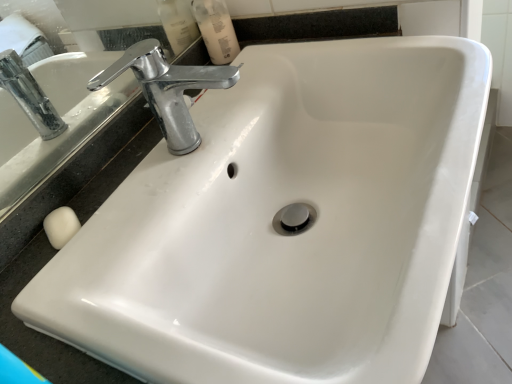
Find the location of a particular element. The image size is (512, 384). translucent plastic mouthwash at upper center is located at coordinates (216, 30).

This screenshot has width=512, height=384. What do you see at coordinates (216, 30) in the screenshot?
I see `translucent plastic mouthwash at upper center` at bounding box center [216, 30].

The image size is (512, 384). Identify the location of chrome metallic faucet at upper left. (168, 89).

Image resolution: width=512 pixels, height=384 pixels. What do you see at coordinates (168, 89) in the screenshot?
I see `chrome metallic faucet at upper left` at bounding box center [168, 89].

This screenshot has width=512, height=384. In order to click on translucent plastic mouthwash at upper center in this screenshot , I will do `click(216, 30)`.

Is chrome metallic faucet at upper left to the right of translucent plastic mouthwash at upper center from the viewer's perspective?

Yes, chrome metallic faucet at upper left is to the right of translucent plastic mouthwash at upper center.

Does chrome metallic faucet at upper left come in front of translucent plastic mouthwash at upper center?

Yes, it is in front of translucent plastic mouthwash at upper center.

Is point (155, 91) more distant than point (207, 31)?

No, it is not.

From the image's perspective, which is below, chrome metallic faucet at upper left or translucent plastic mouthwash at upper center?

Answer: chrome metallic faucet at upper left is shown below in the image.

From a real-world perspective, is chrome metallic faucet at upper left physically located above or below translucent plastic mouthwash at upper center?

chrome metallic faucet at upper left is situated higher than translucent plastic mouthwash at upper center in the real world.

Considering the sizes of objects chrome metallic faucet at upper left and translucent plastic mouthwash at upper center in the image provided, who is thinner, chrome metallic faucet at upper left or translucent plastic mouthwash at upper center?

Thinner between the two is translucent plastic mouthwash at upper center.

Considering the relative sizes of chrome metallic faucet at upper left and translucent plastic mouthwash at upper center in the image provided, is chrome metallic faucet at upper left taller than translucent plastic mouthwash at upper center?

Yes, chrome metallic faucet at upper left is taller than translucent plastic mouthwash at upper center.

Can you confirm if chrome metallic faucet at upper left is smaller than translucent plastic mouthwash at upper center?

No, chrome metallic faucet at upper left is not smaller than translucent plastic mouthwash at upper center.

Is chrome metallic faucet at upper left spatially inside translucent plastic mouthwash at upper center, or outside of it?

The correct answer is: outside.

Is chrome metallic faucet at upper left beside translucent plastic mouthwash at upper center?

No, chrome metallic faucet at upper left is not in contact with translucent plastic mouthwash at upper center.

Is chrome metallic faucet at upper left oriented towards translucent plastic mouthwash at upper center?

No, chrome metallic faucet at upper left is not facing towards translucent plastic mouthwash at upper center.

From the picture: How distant is chrome metallic faucet at upper left from translucent plastic mouthwash at upper center?

chrome metallic faucet at upper left and translucent plastic mouthwash at upper center are 7.59 inches apart from each other.

Locate an element on the screen. tap on the right side of translucent plastic mouthwash at upper center is located at coordinates (168, 89).

Is translucent plastic mouthwash at upper center at the left side of chrome metallic faucet at upper left?

Yes, translucent plastic mouthwash at upper center is to the left of chrome metallic faucet at upper left.

Is translucent plastic mouthwash at upper center positioned behind chrome metallic faucet at upper left?

That is True.

Considering the points (218, 2) and (161, 129), which point is in front, point (218, 2) or point (161, 129)?

Positioned in front is point (161, 129).

From the image's perspective, is translucent plastic mouthwash at upper center positioned above or below chrome metallic faucet at upper left?

Clearly, from the image's perspective, translucent plastic mouthwash at upper center is above chrome metallic faucet at upper left.

From a real-world perspective, who is located higher, translucent plastic mouthwash at upper center or chrome metallic faucet at upper left?

chrome metallic faucet at upper left, from a real-world perspective.

Does translucent plastic mouthwash at upper center have a lesser width compared to chrome metallic faucet at upper left?

Correct, the width of translucent plastic mouthwash at upper center is less than that of chrome metallic faucet at upper left.

Considering the sizes of objects translucent plastic mouthwash at upper center and chrome metallic faucet at upper left in the image provided, who is taller, translucent plastic mouthwash at upper center or chrome metallic faucet at upper left?

chrome metallic faucet at upper left is taller.

Based on their sizes in the image, would you say translucent plastic mouthwash at upper center is bigger or smaller than chrome metallic faucet at upper left?

translucent plastic mouthwash at upper center is smaller than chrome metallic faucet at upper left.

Is chrome metallic faucet at upper left completely or partially inside translucent plastic mouthwash at upper center?

No, chrome metallic faucet at upper left is not surrounded by translucent plastic mouthwash at upper center.

Does translucent plastic mouthwash at upper center touch chrome metallic faucet at upper left?

No, translucent plastic mouthwash at upper center is not making contact with chrome metallic faucet at upper left.

Based on the photo, is translucent plastic mouthwash at upper center oriented towards chrome metallic faucet at upper left?

No, translucent plastic mouthwash at upper center is not facing towards chrome metallic faucet at upper left.

Can you tell me how much translucent plastic mouthwash at upper center and chrome metallic faucet at upper left differ in facing direction?

The angular difference between translucent plastic mouthwash at upper center and chrome metallic faucet at upper left is 0.00362 degrees.

I want to click on tap above the translucent plastic mouthwash at upper center (from a real-world perspective), so click(168, 89).

I want to click on tap below the translucent plastic mouthwash at upper center (from the image's perspective), so click(168, 89).

Where is `mouthwash on the left of chrome metallic faucet at upper left`? Image resolution: width=512 pixels, height=384 pixels. mouthwash on the left of chrome metallic faucet at upper left is located at coordinates (216, 30).